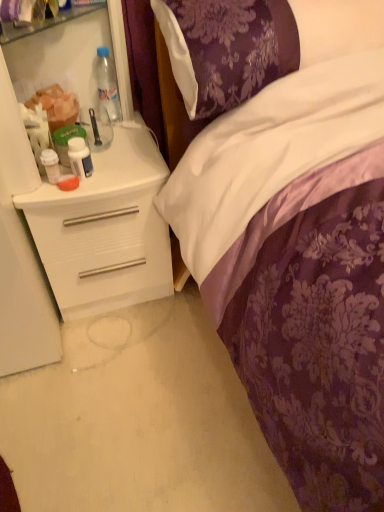
The width and height of the screenshot is (384, 512). Find the location of `translucent plastic cup at left`. translucent plastic cup at left is located at coordinates (56, 106).

The width and height of the screenshot is (384, 512). Identify the location of clear plastic bottle at upper left, which is counted as the first bottle, starting from the top. (107, 87).

Image resolution: width=384 pixels, height=512 pixels. What are the coordinates of `translucent plastic cup at left` in the screenshot? It's located at (56, 106).

Is purple satin pillow at upper center looking in the opposite direction of white plastic desk at left?

No, white plastic desk at left is not at the back of purple satin pillow at upper center.

From a real-world perspective, which is physically below, purple satin pillow at upper center or white plastic desk at left?

From a 3D spatial view, white plastic desk at left is below.

Can you confirm if purple satin pillow at upper center is positioned to the left of white plastic desk at left?

In fact, purple satin pillow at upper center is to the right of white plastic desk at left.

Does purple satin pillow at upper center have a smaller size compared to translucent plastic cup at left?

No, purple satin pillow at upper center is not smaller than translucent plastic cup at left.

Is purple satin pillow at upper center not inside translucent plastic cup at left?

purple satin pillow at upper center lies outside translucent plastic cup at left's area.

Could you tell me if purple satin pillow at upper center is facing translucent plastic cup at left?

No, purple satin pillow at upper center is not aimed at translucent plastic cup at left.

Is purple satin pillow at upper center shorter than translucent plastic cup at left?

In fact, purple satin pillow at upper center may be taller than translucent plastic cup at left.

Which is in front, point (47, 91) or point (78, 176)?

The point (78, 176) is more forward.

How many degrees apart are the facing directions of translucent plastic cup at left and white glossy pill bottle at left, the 2th bottle when ordered from back to front?

90.6 degrees separate the facing orientations of translucent plastic cup at left and white glossy pill bottle at left, the 2th bottle when ordered from back to front.

Considering the sizes of translucent plastic cup at left and white glossy pill bottle at left, the 2th bottle when ordered from back to front, in the image, is translucent plastic cup at left taller or shorter than white glossy pill bottle at left, the 2th bottle when ordered from back to front,?

Considering their sizes, translucent plastic cup at left has more height than white glossy pill bottle at left, the 2th bottle when ordered from back to front.

Does translucent plastic cup at left have a larger size compared to white glossy pill bottle at left, the second bottle in the front-to-back sequence?

Yes.

Is translucent plastic cup at left closer to camera compared to clear plastic bottle at upper left, which appears as the third bottle when ordered from the bottom?

Yes, the depth of translucent plastic cup at left is less than that of clear plastic bottle at upper left, which appears as the third bottle when ordered from the bottom.

Is translucent plastic cup at left touching clear plastic bottle at upper left, the 3th bottle in the front-to-back sequence?

There is a gap between translucent plastic cup at left and clear plastic bottle at upper left, the 3th bottle in the front-to-back sequence.

Can you tell me how much translucent plastic cup at left and clear plastic bottle at upper left, the 3th bottle in the front-to-back sequence, differ in facing direction?

90.6 degrees.

From the image's perspective, who appears lower, translucent plastic cup at left or clear plastic bottle at upper left, which is counted as the first bottle, starting from the top?

translucent plastic cup at left is shown below in the image.

From a real-world perspective, is clear plastic bottle at upper left, the first bottle positioned from the right, positioned under white plastic cup at left, the first bottle ordered from the bottom, based on gravity?

No, from a real-world perspective, clear plastic bottle at upper left, the first bottle positioned from the right, is not below white plastic cup at left, the first bottle ordered from the bottom.

Is clear plastic bottle at upper left, the 3th bottle from the left, inside or outside of white plastic cup at left, positioned as the first bottle in front-to-back order?

clear plastic bottle at upper left, the 3th bottle from the left, is spatially situated outside white plastic cup at left, positioned as the first bottle in front-to-back order.

Is clear plastic bottle at upper left, the 3th bottle in the front-to-back sequence, oriented towards white plastic cup at left, the 3th bottle from the back?

No, clear plastic bottle at upper left, the 3th bottle in the front-to-back sequence, is not oriented towards white plastic cup at left, the 3th bottle from the back.

Is the position of clear plastic bottle at upper left, which appears as the third bottle when ordered from the bottom, more distant than that of white plastic cup at left, which is the 1th bottle in left-to-right order?

Yes, clear plastic bottle at upper left, which appears as the third bottle when ordered from the bottom, is further from the viewer.

Is purple satin pillow at upper center next to clear plastic bottle at upper left, the 3th bottle from the left, and touching it?

There is a gap between purple satin pillow at upper center and clear plastic bottle at upper left, the 3th bottle from the left.

From a real-world perspective, is purple satin pillow at upper center physically above clear plastic bottle at upper left, the 3th bottle in the front-to-back sequence?

Correct, in the physical world, purple satin pillow at upper center is higher than clear plastic bottle at upper left, the 3th bottle in the front-to-back sequence.

Which is in front, point (172, 7) or point (102, 105)?

The point (172, 7) is more forward.

Can you tell me how much purple satin pillow at upper center and clear plastic bottle at upper left, the 1th bottle viewed from the back, differ in facing direction?

2.15 degrees.

At what (x,y) coordinates should I click in order to perform the action: click on bottle that is the 2nd object located behind the white plastic desk at left. Please return your answer as a coordinate pair (x, y). This screenshot has height=512, width=384. Looking at the image, I should click on (80, 158).

From a real-world perspective, is white plastic desk at left above or below white glossy pill bottle at left, the 2th bottle when ordered from back to front?

From a real-world perspective, white plastic desk at left is physically below white glossy pill bottle at left, the 2th bottle when ordered from back to front.

Visually, is white plastic desk at left positioned to the left or to the right of white glossy pill bottle at left, the second bottle in the front-to-back sequence?

Based on their positions, white plastic desk at left is located to the left of white glossy pill bottle at left, the second bottle in the front-to-back sequence.

Would you say white plastic desk at left is a long distance from white glossy pill bottle at left, the 2th bottle when ordered from bottom to top?

No, there isn't a large distance between white plastic desk at left and white glossy pill bottle at left, the 2th bottle when ordered from bottom to top.

This screenshot has width=384, height=512. Find the location of `pillow on the right of the white plastic desk at left`. pillow on the right of the white plastic desk at left is located at coordinates (227, 49).

The image size is (384, 512). What are the coordinates of `pillow positioned vertically above the translucent plastic cup at left (from a real-world perspective)` in the screenshot? It's located at (227, 49).

From the image, which object appears to be nearer to white glossy pill bottle at left, the second bottle in the front-to-back sequence, purple satin pillow at upper center or translucent plastic cup at left?

translucent plastic cup at left is positioned closer to the anchor white glossy pill bottle at left, the second bottle in the front-to-back sequence.

From the image, which object appears to be nearer to clear plastic bottle at upper left, which is counted as the first bottle, starting from the top, purple satin pillow at upper center or translucent plastic cup at left?

translucent plastic cup at left is positioned closer to the anchor clear plastic bottle at upper left, which is counted as the first bottle, starting from the top.

When comparing their distances from translucent plastic cup at left, does purple satin pillow at upper center or clear plastic bottle at upper left, the first bottle positioned from the right, seem closer?

Among the two, clear plastic bottle at upper left, the first bottle positioned from the right, is located nearer to translucent plastic cup at left.

Considering their positions, is white plastic desk at left positioned closer to white plastic cup at left, the 3th bottle from the back, than clear plastic bottle at upper left, which appears as the third bottle when ordered from the bottom?

Based on the image, white plastic desk at left appears to be nearer to white plastic cup at left, the 3th bottle from the back.

Looking at the image, which one is located further to clear plastic bottle at upper left, the 3th bottle in the front-to-back sequence, white plastic cup at left, the 3th bottle from the back, or white glossy pill bottle at left, which is counted as the second bottle, starting from the right?

white plastic cup at left, the 3th bottle from the back, is further to clear plastic bottle at upper left, the 3th bottle in the front-to-back sequence.

Which object lies nearer to the anchor point white glossy pill bottle at left, the second bottle in the front-to-back sequence, translucent plastic cup at left or white plastic desk at left?

translucent plastic cup at left is closer to white glossy pill bottle at left, the second bottle in the front-to-back sequence.

Estimate the real-world distances between objects in this image. Which object is closer to white plastic desk at left, translucent plastic cup at left or purple satin pillow at upper center?

translucent plastic cup at left is closer to white plastic desk at left.

Which object lies further to the anchor point purple satin pillow at upper center, translucent plastic cup at left or white plastic cup at left, positioned as the third bottle in top-to-bottom order?

Based on the image, white plastic cup at left, positioned as the third bottle in top-to-bottom order, appears to be further to purple satin pillow at upper center.

Locate an element on the screen. This screenshot has height=512, width=384. bottle between white glossy pill bottle at left, which is the 2th bottle from top to bottom, and purple satin pillow at upper center, in the horizontal direction is located at coordinates (107, 87).

You are a GUI agent. You are given a task and a screenshot of the screen. Output one action in this format:
    pyautogui.click(x=<x>, y=<y>)
    Task: Click on the food between clear plastic bottle at upper left, the 1th bottle viewed from the back, and white plastic cup at left, positioned as the third bottle in top-to-bottom order, vertically
    The width and height of the screenshot is (384, 512).
    Given the screenshot: What is the action you would take?
    pyautogui.click(x=56, y=106)

Locate an element on the screen. The image size is (384, 512). desk situated between translucent plastic cup at left and purple satin pillow at upper center from left to right is located at coordinates (105, 229).

In order to click on bottle between clear plastic bottle at upper left, the 3th bottle in the front-to-back sequence, and white plastic cup at left, the 3th bottle viewed from the right, from top to bottom in this screenshot , I will do pyautogui.click(x=80, y=158).